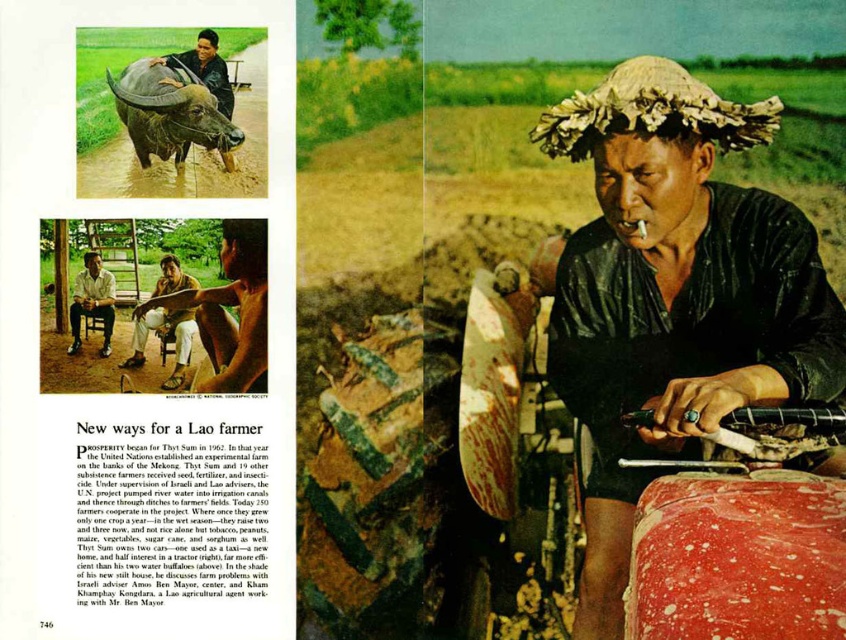
Which is behind, point (591, 634) or point (108, 289)?

Point (108, 289)

Does wet black shirt at center have a larger size compared to light brown wooden chair at lower left?

Correct, wet black shirt at center is larger in size than light brown wooden chair at lower left.

Does point (779, 371) come closer to viewer compared to point (89, 276)?

Yes, point (779, 371) is in front of point (89, 276).

This screenshot has width=846, height=640. I want to click on wet black shirt at center, so click(673, 296).

Between wet black shirt at center and brown leather shirt at center, which one appears on the left side from the viewer's perspective?

brown leather shirt at center

Image resolution: width=846 pixels, height=640 pixels. Describe the element at coordinates (673, 296) in the screenshot. I see `wet black shirt at center` at that location.

Which is behind, point (603, 333) or point (182, 275)?

Positioned behind is point (603, 333).

Identify the location of wet black shirt at center. (673, 296).

Consider the image. Is brown leather shirt at center further to the viewer compared to light brown wooden chair at lower left?

Yes, brown leather shirt at center is behind light brown wooden chair at lower left.

Is brown leather shirt at center bigger than light brown wooden chair at lower left?

Yes.

Between point (163, 316) and point (97, 310), which one is positioned behind?

Positioned behind is point (163, 316).

Image resolution: width=846 pixels, height=640 pixels. I want to click on brown leather shirt at center, so tap(163, 337).